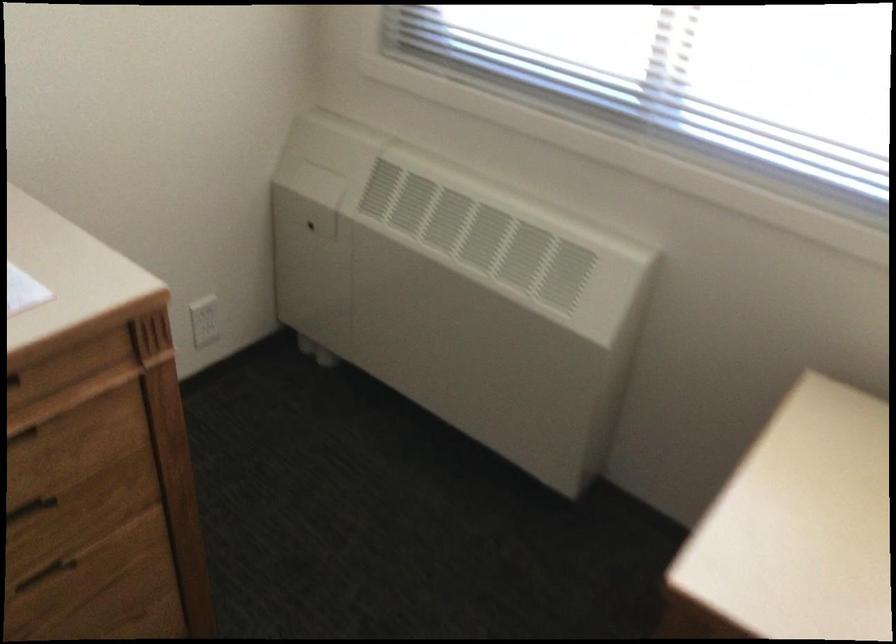
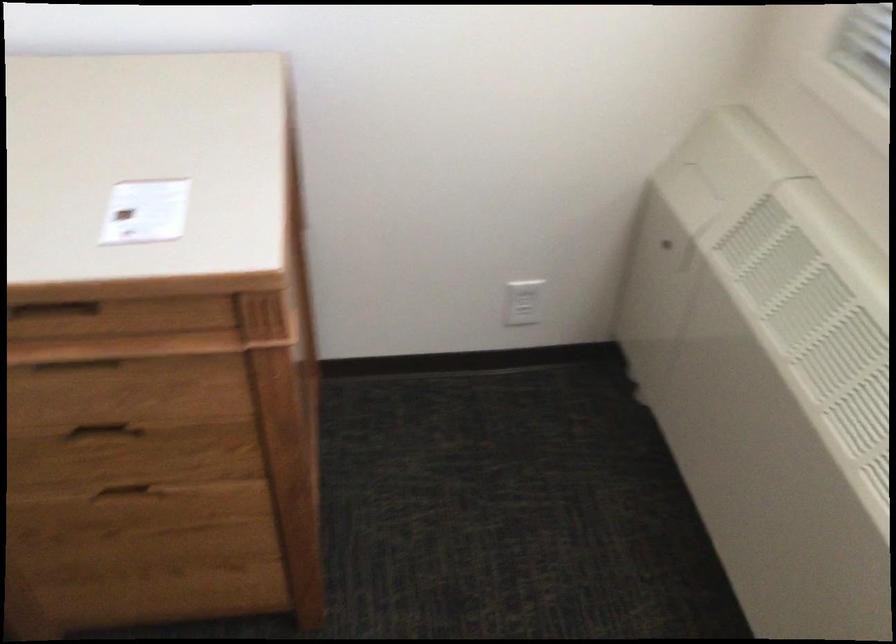
The point at (209, 326) is marked in the first image. Where is the corresponding point in the second image?

(522, 301)